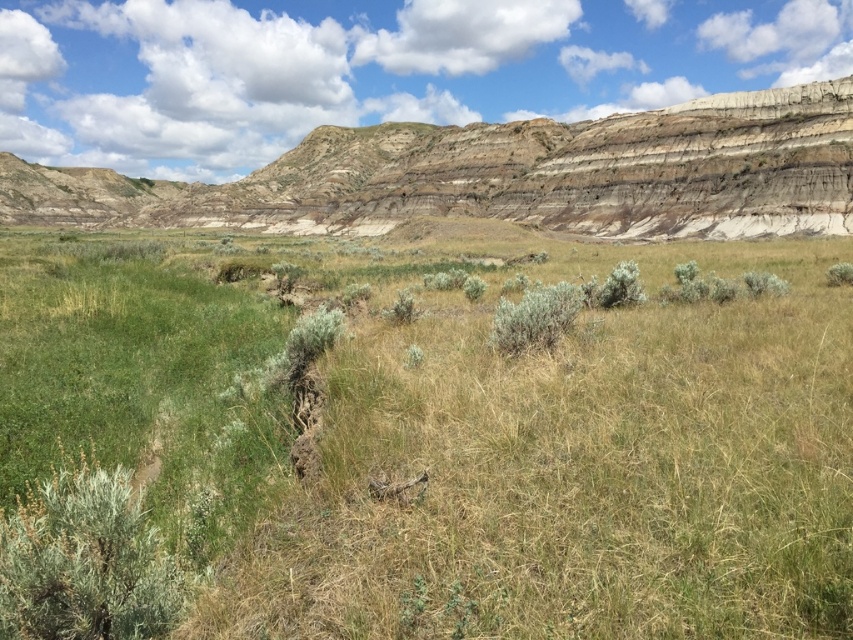
You are standing at the point marked by the coordinates point (457, 442) in the image. What type of terrain are you currently standing on?

The point (457, 442) indicates green grass at center, so you are standing on green grass.

You are standing in the open landscape and want to place a small statue on the ground. You have two options for placement based on the objects in the scene. Which object, green grass at center or green fuzzy bush at center, is higher up and thus a better spot for the statue to be more visible?

The green grass at center is located above the green fuzzy bush at center, so placing the statue there would make it more visible.

You are standing at the point marked by the coordinates point (457,442) in the image. What type of terrain feature are you currently standing on?

The point (457,442) corresponds to green grass at center, so you are standing on green grass at center.